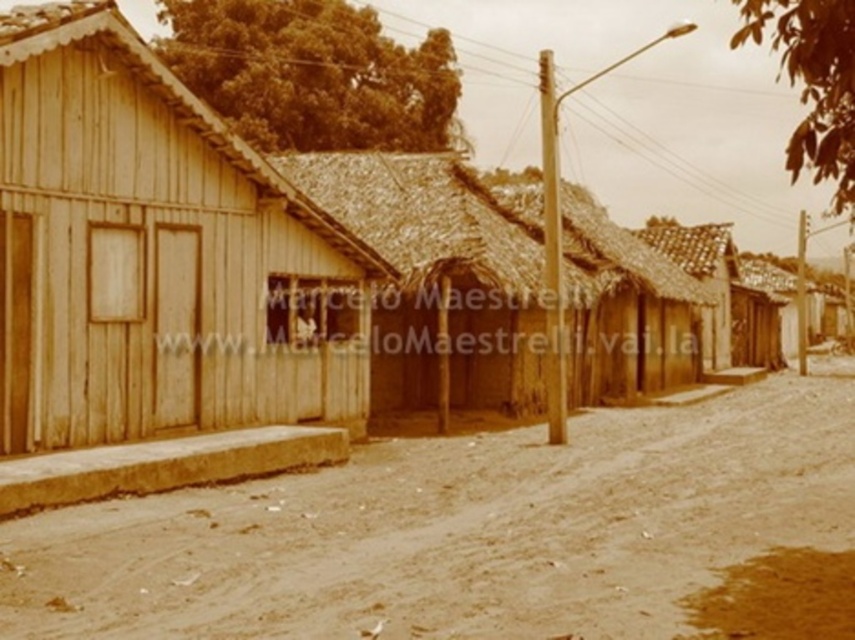
Looking at this image, which is below, brown sandy dirt field at center or wooden hut at left?

Positioned lower is brown sandy dirt field at center.

Who is shorter, brown sandy dirt field at center or wooden hut at left?

Standing shorter between the two is brown sandy dirt field at center.

Locate an element on the screen. brown sandy dirt field at center is located at coordinates (457, 531).

Find the location of a particular element. This screenshot has height=640, width=855. brown sandy dirt field at center is located at coordinates (457, 531).

From the picture: Does wooden hut at left appear over brown wooden hut at center?

No, wooden hut at left is not above brown wooden hut at center.

Between wooden hut at left and brown wooden hut at center, which one appears on the right side from the viewer's perspective?

brown wooden hut at center is more to the right.

The image size is (855, 640). What are the coordinates of `wooden hut at left` in the screenshot? It's located at (154, 262).

The image size is (855, 640). What do you see at coordinates (457, 531) in the screenshot?
I see `brown sandy dirt field at center` at bounding box center [457, 531].

Is brown sandy dirt field at center thinner than brown wooden hut at center?

Incorrect, brown sandy dirt field at center's width is not less than brown wooden hut at center's.

Is point (677, 500) more distant than point (679, 326)?

No, (677, 500) is closer to viewer.

Find the location of `brown sandy dirt field at center`. brown sandy dirt field at center is located at coordinates (457, 531).